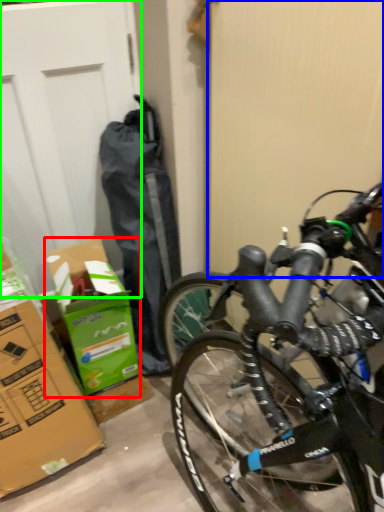
Question: Considering the real-world distances, which object is closest to cardboard box (highlighted by a red box)? screen door (highlighted by a blue box) or garage door (highlighted by a green box).

Choices:
 (A) screen door
 (B) garage door

Answer: (B)